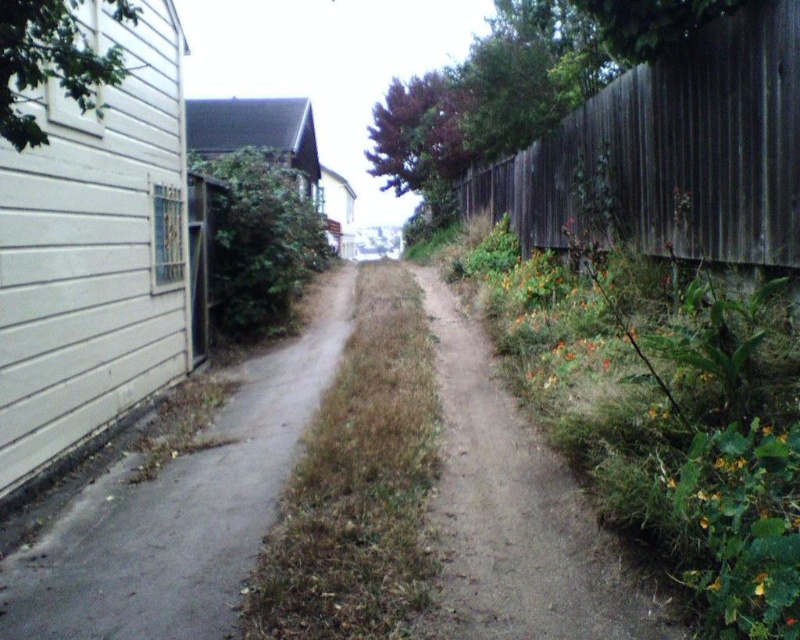
Question: Can you confirm if dark brown wood fence at right is smaller than gray concrete path at left?

Choices:
 (A) yes
 (B) no

Answer: (A)

Question: Considering the relative positions of gray concrete path at left and brown dirt path at center in the image provided, where is gray concrete path at left located with respect to brown dirt path at center?

Choices:
 (A) left
 (B) right

Answer: (A)

Question: Which point is closer to the camera taking this photo?

Choices:
 (A) (397, 433)
 (B) (32, 589)
 (C) (601, 136)
 (D) (600, 547)

Answer: (D)

Question: Which object appears farthest from the camera in this image?

Choices:
 (A) brown dirt path at center
 (B) dry grass at center

Answer: (A)

Question: Does gray concrete path at left have a larger size compared to brown dirt path at center?

Choices:
 (A) no
 (B) yes

Answer: (B)

Question: Based on their relative distances, which object is nearer to the dry grass at center?

Choices:
 (A) brown dirt path at center
 (B) gray concrete path at left
 (C) dark brown wood fence at right

Answer: (A)